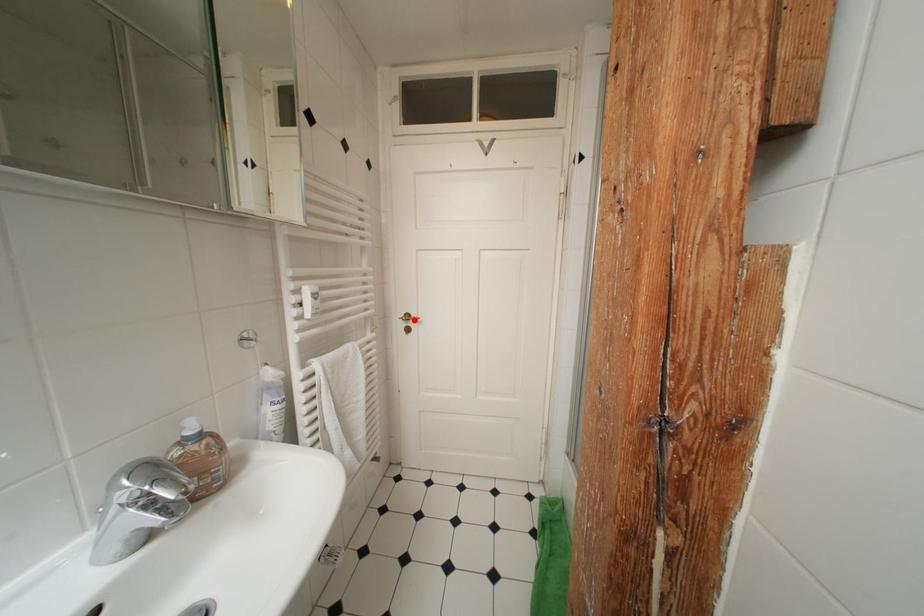
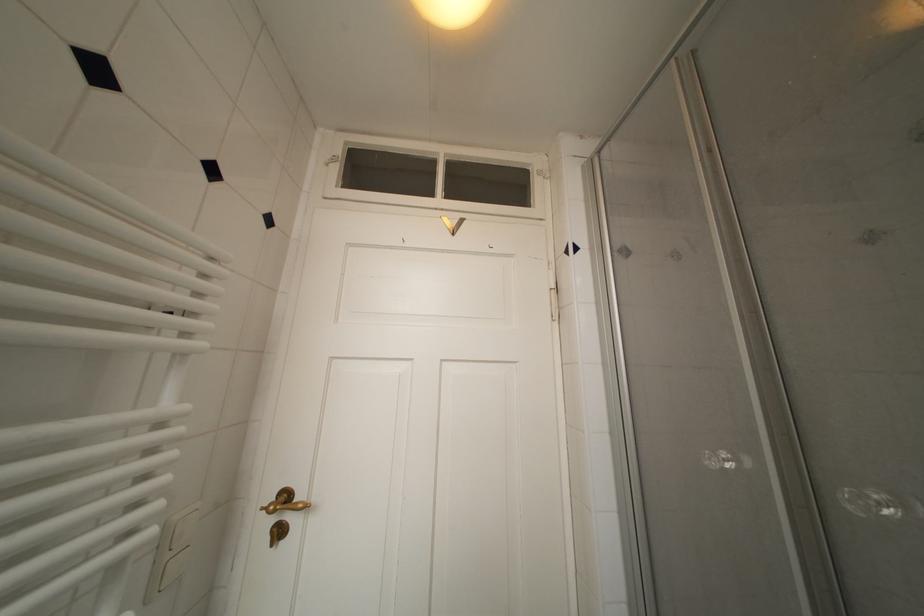
Where in the second image is the point corresponding to the highlighted location from the first image?

(293, 500)